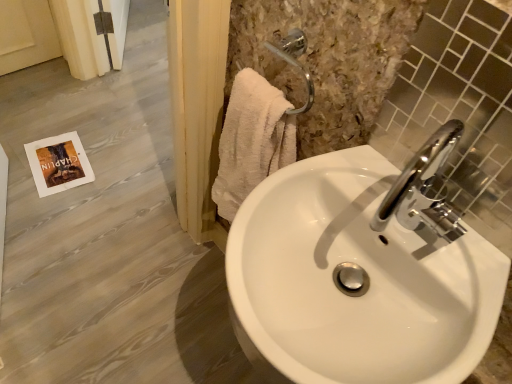
Image resolution: width=512 pixels, height=384 pixels. Identify the location of free region on the left part of chrome metallic faucet at upper right. (332, 186).